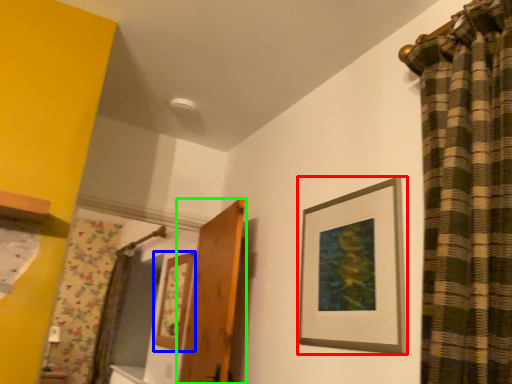
Question: Considering the real-world distances, which object is closest to picture frame (highlighted by a red box)? picture frame (highlighted by a blue box) or door (highlighted by a green box).

Choices:
 (A) picture frame
 (B) door

Answer: (B)